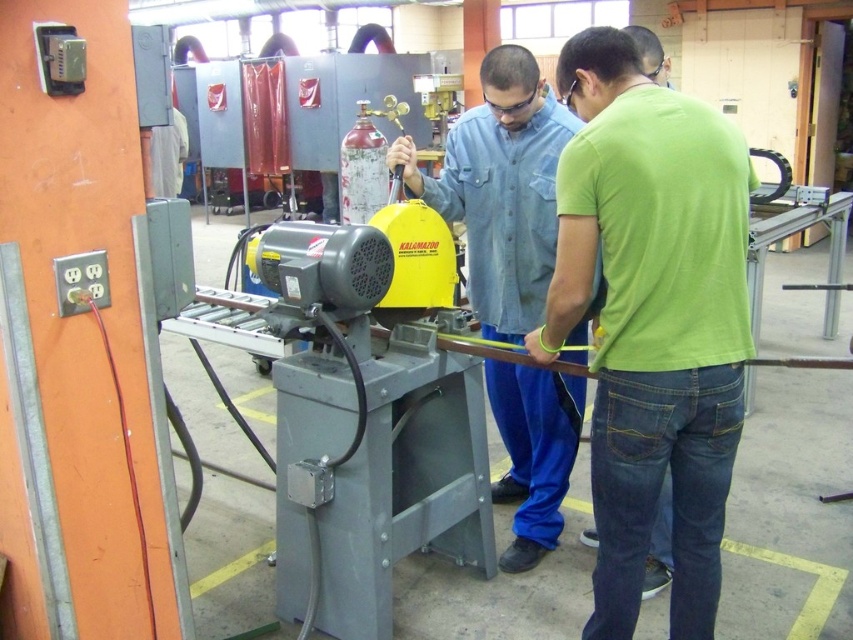
Question: Does green cotton shirt at center lie behind denim shirt at center?

Choices:
 (A) yes
 (B) no

Answer: (B)

Question: Is green cotton shirt at center bigger than denim shirt at center?

Choices:
 (A) no
 (B) yes

Answer: (A)

Question: Which point is farther to the camera?

Choices:
 (A) green cotton shirt at center
 (B) denim shirt at center

Answer: (B)

Question: Is green cotton shirt at center smaller than denim shirt at center?

Choices:
 (A) yes
 (B) no

Answer: (A)